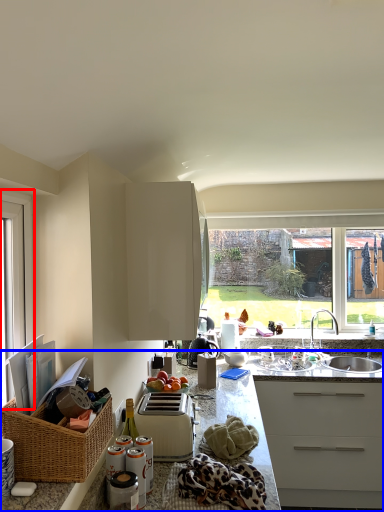
Question: Among these objects, which one is farthest to the camera, window (highlighted by a red box) or countertop (highlighted by a blue box)?

Choices:
 (A) window
 (B) countertop

Answer: (A)